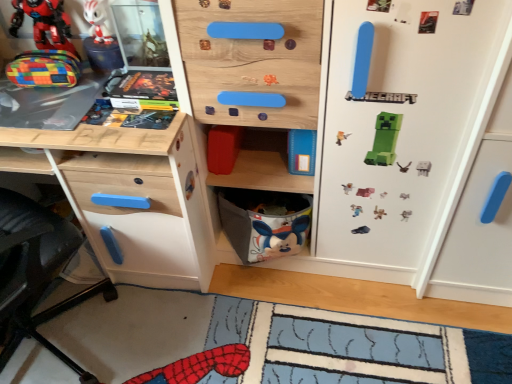
In order to click on vacant area on top of hardcover comic book at upper left (from a real-world perspective) in this screenshot , I will do `click(154, 82)`.